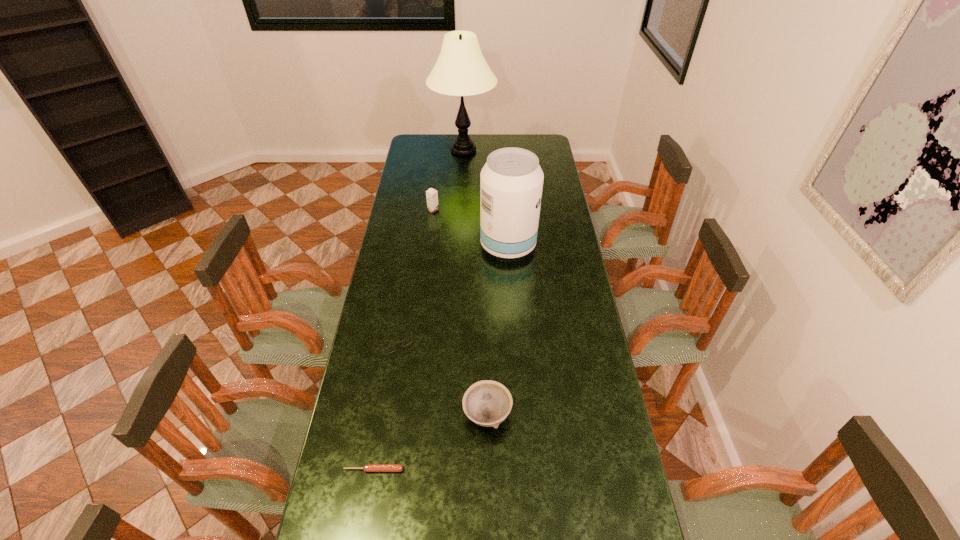
Where is `the nearest object`? the nearest object is located at coordinates (367, 467).

Identify the location of the shortest object. (367, 467).

Identify the location of free point located on the right of the lamp. Image resolution: width=960 pixels, height=540 pixels. (546, 150).

At what (x,y) coordinates should I click in order to perform the action: click on vacant region located on the back of the second tallest object. Please return your answer as a coordinate pair (x, y). Looking at the image, I should click on (505, 202).

This screenshot has width=960, height=540. I want to click on free space located 0.360m on the right of the chocolate milk, so click(x=516, y=210).

This screenshot has width=960, height=540. I want to click on free space located 0.060m on the left of the second nearest object, so click(443, 414).

Where is `free space located 0.050m with the lenses facing outward on the second shortest object`? The height and width of the screenshot is (540, 960). free space located 0.050m with the lenses facing outward on the second shortest object is located at coordinates (390, 369).

Locate an element on the screen. free space located on the right of the sausage is located at coordinates (480, 470).

The width and height of the screenshot is (960, 540). Identify the location of object that is at the far edge. (461, 70).

Locate an element on the screen. lamp located in the left edge section of the desktop is located at coordinates (461, 70).